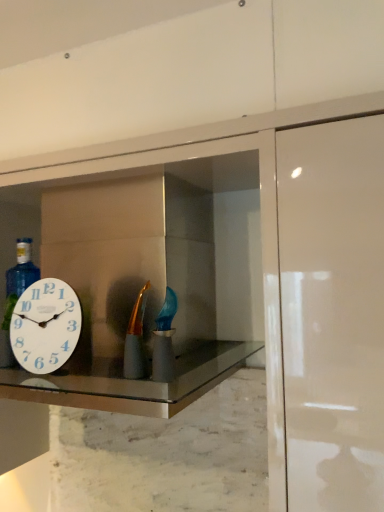
Question: Is matte gold bottle at center oriented towards white glossy medicine cabinet at center?

Choices:
 (A) yes
 (B) no

Answer: (B)

Question: From a real-world perspective, is matte gold bottle at center beneath white glossy medicine cabinet at center?

Choices:
 (A) yes
 (B) no

Answer: (B)

Question: Is matte gold bottle at center oriented away from white glossy medicine cabinet at center?

Choices:
 (A) no
 (B) yes

Answer: (B)

Question: Considering the relative sizes of matte gold bottle at center and white glossy medicine cabinet at center in the image provided, is matte gold bottle at center smaller than white glossy medicine cabinet at center?

Choices:
 (A) yes
 (B) no

Answer: (A)

Question: Would you say matte gold bottle at center is a long distance from white glossy medicine cabinet at center?

Choices:
 (A) no
 (B) yes

Answer: (B)

Question: Relative to white glossy medicine cabinet at center, is matte gold bottle at center in front or behind?

Choices:
 (A) front
 (B) behind

Answer: (B)

Question: Would you say matte gold bottle at center is to the left or to the right of white glossy medicine cabinet at center in the picture?

Choices:
 (A) right
 (B) left

Answer: (A)

Question: Is point coord(135,309) closer or farther from the camera than point coord(54,376)?

Choices:
 (A) closer
 (B) farther

Answer: (A)

Question: Which is correct: matte gold bottle at center is inside white glossy medicine cabinet at center, or outside of it?

Choices:
 (A) inside
 (B) outside

Answer: (B)

Question: From a real-world perspective, relative to marble at center, is white glossy clock at left vertically above or below?

Choices:
 (A) below
 (B) above

Answer: (B)

Question: From the image's perspective, is white glossy clock at left positioned above or below marble at center?

Choices:
 (A) above
 (B) below

Answer: (A)

Question: Looking at the image, does white glossy clock at left seem bigger or smaller compared to marble at center?

Choices:
 (A) small
 (B) big

Answer: (A)

Question: In the image, is white glossy clock at left on the left side or the right side of marble at center?

Choices:
 (A) left
 (B) right

Answer: (A)

Question: From a real-world perspective, is white glossy clock at left positioned above or below white glossy medicine cabinet at center?

Choices:
 (A) below
 (B) above

Answer: (B)

Question: Based on their positions, is white glossy clock at left located to the left or right of white glossy medicine cabinet at center?

Choices:
 (A) left
 (B) right

Answer: (A)